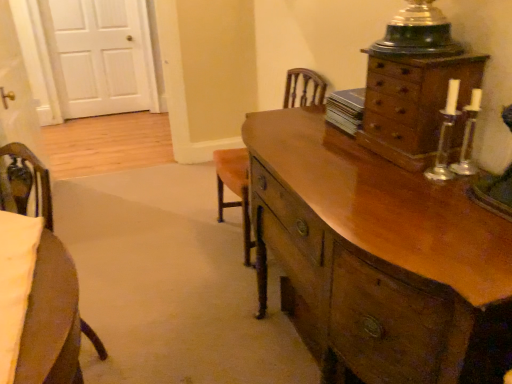
The width and height of the screenshot is (512, 384). I want to click on vacant area on top of shiny brown wooden chest of drawers at right, acting as the first chest of drawers starting from the bottom (from a real-world perspective), so click(x=362, y=167).